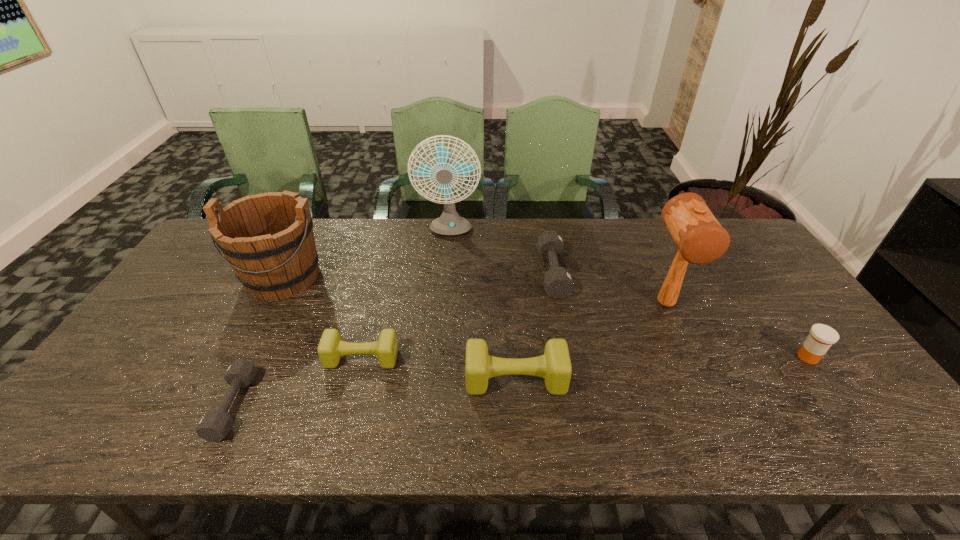
Where is `free space located 0.220m on the back of the smaller olive dumbbell`? Image resolution: width=960 pixels, height=540 pixels. free space located 0.220m on the back of the smaller olive dumbbell is located at coordinates (379, 290).

The image size is (960, 540). Find the location of `vacant region located on the right of the shortest dumbbell`. vacant region located on the right of the shortest dumbbell is located at coordinates (388, 406).

Identify the location of fan that is positioned at the far edge. The height and width of the screenshot is (540, 960). (449, 223).

This screenshot has width=960, height=540. I want to click on wine bucket that is positioned at the far edge, so click(268, 240).

This screenshot has height=540, width=960. Identify the location of dumbbell located at the far edge. (558, 283).

Identify the location of object that is positioned at the near edge. The width and height of the screenshot is (960, 540). (214, 425).

Where is `object that is positioned at the right edge`? object that is positioned at the right edge is located at coordinates (821, 337).

The width and height of the screenshot is (960, 540). Find the location of `vacant region at the far edge of the desktop`. vacant region at the far edge of the desktop is located at coordinates (478, 253).

This screenshot has width=960, height=540. In the image, there is a desktop. In order to click on vacant space at the near edge in this screenshot , I will do `click(817, 440)`.

At what (x,y) coordinates should I click in order to perform the action: click on free region at the left edge of the desktop. Please return your answer as a coordinate pair (x, y). Looking at the image, I should click on (213, 298).